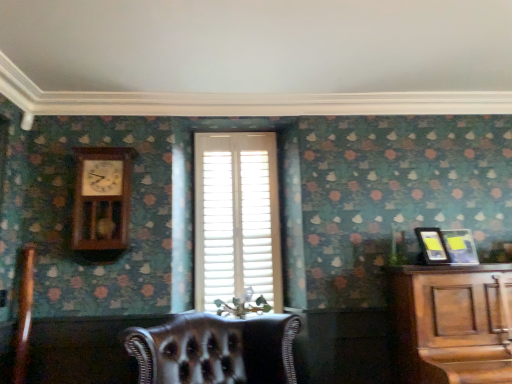
Question: Is metallic silver picture frame at right, which is the 1th picture frame from right to left, wider than matte black picture frame at right, which is counted as the second picture frame, starting from the right?

Choices:
 (A) no
 (B) yes

Answer: (B)

Question: Does metallic silver picture frame at right, which is the 1th picture frame from right to left, have a smaller size compared to matte black picture frame at right, arranged as the 1th picture frame when viewed from the left?

Choices:
 (A) no
 (B) yes

Answer: (A)

Question: Does metallic silver picture frame at right, the second picture frame in the left-to-right sequence, appear on the right side of matte black picture frame at right, which is counted as the second picture frame, starting from the right?

Choices:
 (A) no
 (B) yes

Answer: (B)

Question: Can you confirm if metallic silver picture frame at right, the second picture frame in the left-to-right sequence, is bigger than matte black picture frame at right, arranged as the 1th picture frame when viewed from the left?

Choices:
 (A) yes
 (B) no

Answer: (A)

Question: Can you confirm if metallic silver picture frame at right, the second picture frame in the left-to-right sequence, is thinner than matte black picture frame at right, arranged as the 1th picture frame when viewed from the left?

Choices:
 (A) yes
 (B) no

Answer: (B)

Question: Considering the positions of leather at center and wooden pendulum clock at upper left in the image, is leather at center bigger or smaller than wooden pendulum clock at upper left?

Choices:
 (A) small
 (B) big

Answer: (B)

Question: From the image's perspective, relative to wooden pendulum clock at upper left, is leather at center above or below?

Choices:
 (A) above
 (B) below

Answer: (B)

Question: Is leather at center inside or outside of wooden pendulum clock at upper left?

Choices:
 (A) inside
 (B) outside

Answer: (B)

Question: Considering the positions of point (189, 339) and point (108, 231), is point (189, 339) closer or farther from the camera than point (108, 231)?

Choices:
 (A) closer
 (B) farther

Answer: (A)

Question: Considering the positions of point (245, 160) and point (435, 235), is point (245, 160) closer or farther from the camera than point (435, 235)?

Choices:
 (A) closer
 (B) farther

Answer: (B)

Question: Is white wood blinds at center to the left or to the right of matte black picture frame at right, which is counted as the second picture frame, starting from the right, in the image?

Choices:
 (A) right
 (B) left

Answer: (B)

Question: Relative to matte black picture frame at right, arranged as the 1th picture frame when viewed from the left, is white wood blinds at center in front or behind?

Choices:
 (A) front
 (B) behind

Answer: (B)

Question: From a real-world perspective, is white wood blinds at center above or below matte black picture frame at right, arranged as the 1th picture frame when viewed from the left?

Choices:
 (A) below
 (B) above

Answer: (B)

Question: In the image, is wooden pendulum clock at upper left on the left side or the right side of leather armchair at lower left?

Choices:
 (A) right
 (B) left

Answer: (A)

Question: Is wooden pendulum clock at upper left situated inside leather armchair at lower left or outside?

Choices:
 (A) outside
 (B) inside

Answer: (A)